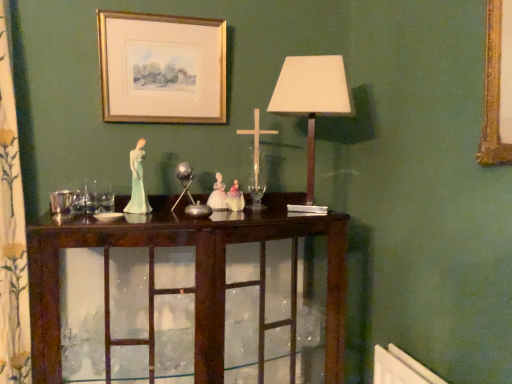
Locate an element on the screen. free point to the right of porcelain figure at center is located at coordinates (173, 216).